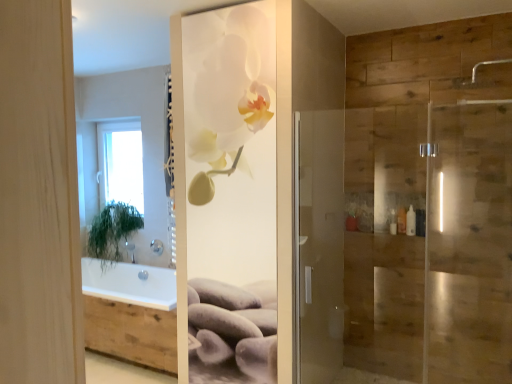
Question: From a real-world perspective, is white glossy orchid at center physically above white plastic bottle at right?

Choices:
 (A) yes
 (B) no

Answer: (A)

Question: Is white glossy orchid at center outside of white plastic bottle at right?

Choices:
 (A) yes
 (B) no

Answer: (A)

Question: Is the depth of white glossy orchid at center greater than that of white plastic bottle at right?

Choices:
 (A) yes
 (B) no

Answer: (B)

Question: From a real-world perspective, is white glossy orchid at center under white plastic bottle at right?

Choices:
 (A) no
 (B) yes

Answer: (A)

Question: Considering the relative sizes of white glossy orchid at center and white plastic bottle at right in the image provided, is white glossy orchid at center bigger than white plastic bottle at right?

Choices:
 (A) no
 (B) yes

Answer: (B)

Question: In the image, is satin nickel showerhead at upper center, the 1th shower in the bottom-to-top sequence, on the left side or the right side of white plastic bottle at right?

Choices:
 (A) right
 (B) left

Answer: (B)

Question: Relative to white plastic bottle at right, is satin nickel showerhead at upper center, the 2th shower viewed from the right, in front or behind?

Choices:
 (A) behind
 (B) front

Answer: (A)

Question: Which is correct: satin nickel showerhead at upper center, the 1th shower in the bottom-to-top sequence, is inside white plastic bottle at right, or outside of it?

Choices:
 (A) inside
 (B) outside

Answer: (B)

Question: Is point (158, 243) positioned closer to the camera than point (409, 231)?

Choices:
 (A) farther
 (B) closer

Answer: (A)

Question: Is green leafy plant at left wider or thinner than white glossy orchid at center?

Choices:
 (A) thin
 (B) wide

Answer: (B)

Question: From the image's perspective, is green leafy plant at left above or below white glossy orchid at center?

Choices:
 (A) above
 (B) below

Answer: (B)

Question: Is point (102, 258) closer or farther from the camera than point (197, 82)?

Choices:
 (A) farther
 (B) closer

Answer: (A)

Question: Which is correct: green leafy plant at left is inside white glossy orchid at center, or outside of it?

Choices:
 (A) inside
 (B) outside

Answer: (B)

Question: Considering the positions of point (413, 226) and point (99, 180), is point (413, 226) closer or farther from the camera than point (99, 180)?

Choices:
 (A) farther
 (B) closer

Answer: (B)

Question: Is white plastic bottle at right situated inside white glass window at upper left or outside?

Choices:
 (A) outside
 (B) inside

Answer: (A)